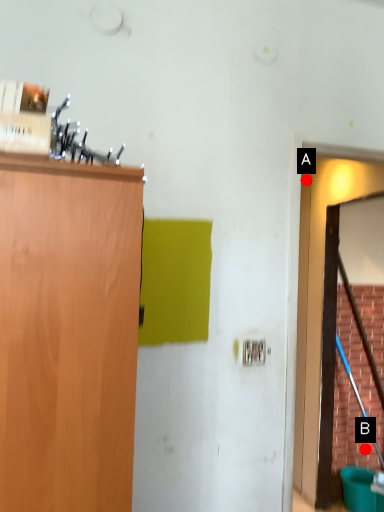
Question: Two points are circled on the image, labeled by A and B beside each circle. Which of the following is the closest to the observer?

Choices:
 (A) A is closer
 (B) B is closer

Answer: (A)